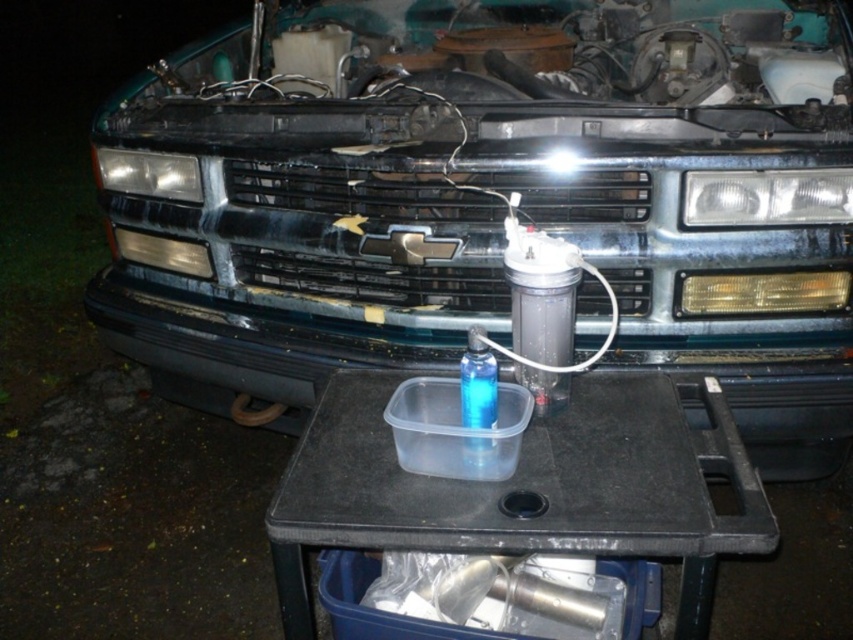
Question: Is black plastic table at center wider than matte plastic headlight at left?

Choices:
 (A) no
 (B) yes

Answer: (B)

Question: Can you confirm if matte plastic headlight at right is positioned below matte black headlight at left?

Choices:
 (A) no
 (B) yes

Answer: (B)

Question: Which is farther from the transparent plastic bottle at center?

Choices:
 (A) matte plastic headlight at left
 (B) matte plastic headlight at right
 (C) black plastic table at center
 (D) glossy metallic car at center

Answer: (A)

Question: In this image, where is black plastic table at center located relative to matte plastic headlight at right?

Choices:
 (A) right
 (B) left

Answer: (B)

Question: Which point appears closest to the camera in this image?

Choices:
 (A) (178, 188)
 (B) (482, 436)
 (C) (722, 288)

Answer: (B)

Question: Which point appears farthest from the camera in this image?

Choices:
 (A) (686, 556)
 (B) (181, 192)
 (C) (830, 193)

Answer: (B)